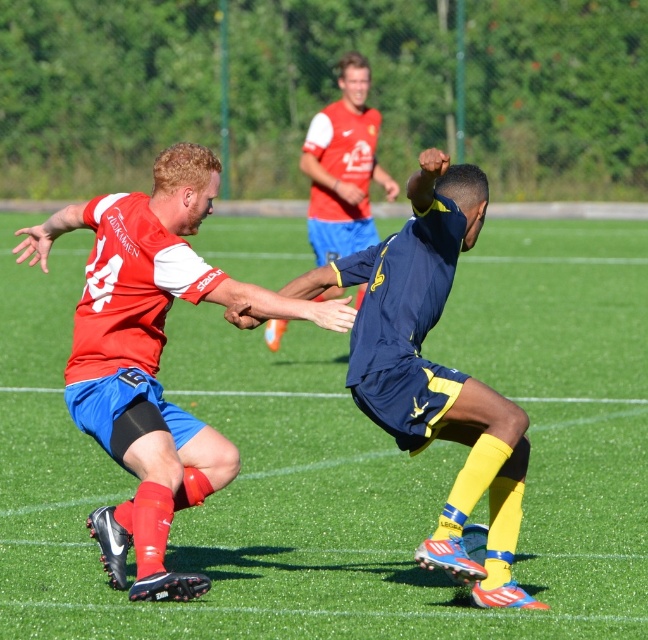
Question: Can you confirm if matte red jersey at center is wider than blue matte shorts at center?

Choices:
 (A) yes
 (B) no

Answer: (A)

Question: Which of these objects is positioned farthest from the matte red jersey at center?

Choices:
 (A) blue matte shorts at center
 (B) matte blue shorts at center
 (C) green grass football field at center

Answer: (B)

Question: Does matte red jersey at center appear on the right side of matte blue shorts at center?

Choices:
 (A) yes
 (B) no

Answer: (B)

Question: Is green grass football field at center to the left of matte blue shorts at center from the viewer's perspective?

Choices:
 (A) yes
 (B) no

Answer: (A)

Question: Which is nearer to the matte blue shorts at center?

Choices:
 (A) matte red jersey at center
 (B) blue matte shorts at center
 (C) green grass football field at center

Answer: (C)

Question: Which object is positioned farthest from the matte red jersey at center?

Choices:
 (A) green grass football field at center
 (B) blue matte shorts at center

Answer: (A)